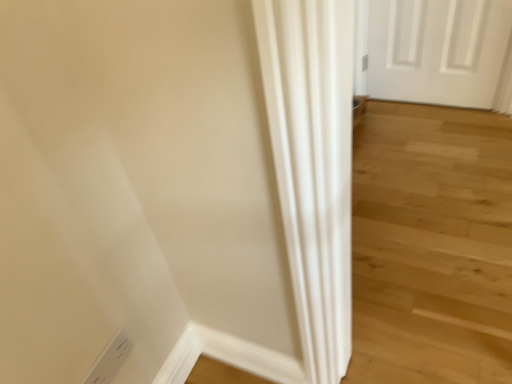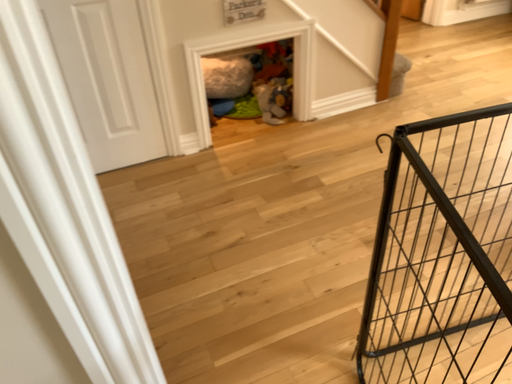
Question: Which way did the camera rotate in the video?

Choices:
 (A) rotated left
 (B) rotated right

Answer: (B)